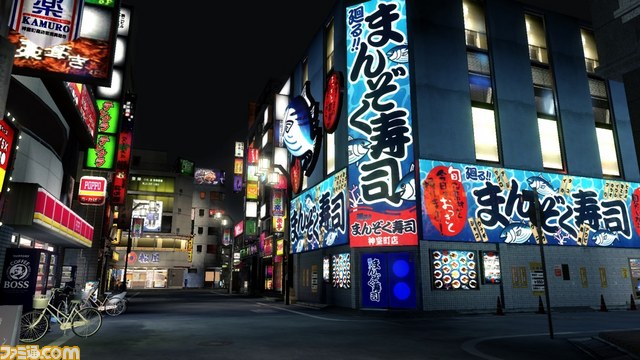
Identify the location of windows. tap(483, 119), tap(544, 139), tap(605, 139), tap(202, 193), tap(201, 212), tap(200, 229), tap(200, 247).